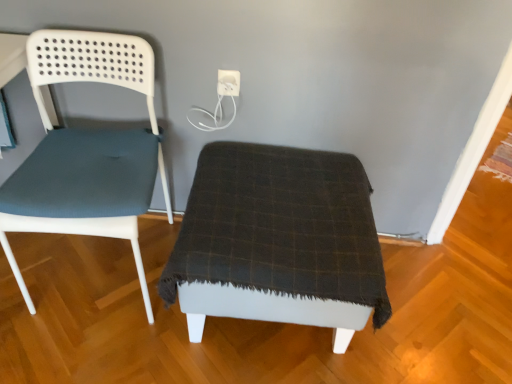
Question: From a real-world perspective, is dark plaid fabric ottoman at center under matte blue fabric chair at left?

Choices:
 (A) yes
 (B) no

Answer: (A)

Question: Is dark plaid fabric ottoman at center next to matte blue fabric chair at left and touching it?

Choices:
 (A) yes
 (B) no

Answer: (B)

Question: Is dark plaid fabric ottoman at center at the right side of matte blue fabric chair at left?

Choices:
 (A) yes
 (B) no

Answer: (A)

Question: From the image's perspective, is dark plaid fabric ottoman at center located above matte blue fabric chair at left?

Choices:
 (A) no
 (B) yes

Answer: (A)

Question: Is matte blue fabric chair at left at the back of dark plaid fabric ottoman at center?

Choices:
 (A) yes
 (B) no

Answer: (B)

Question: Do you think white plastic electric outlet at upper center is within dark plaid fabric ottoman at center, or outside of it?

Choices:
 (A) outside
 (B) inside

Answer: (A)

Question: In the image, is white plastic electric outlet at upper center positioned in front of or behind dark plaid fabric ottoman at center?

Choices:
 (A) front
 (B) behind

Answer: (B)

Question: Is point (222, 82) positioned closer to the camera than point (286, 314)?

Choices:
 (A) farther
 (B) closer

Answer: (A)

Question: In the image, is white plastic electric outlet at upper center on the left side or the right side of dark plaid fabric ottoman at center?

Choices:
 (A) right
 (B) left

Answer: (B)

Question: From a real-world perspective, is dark plaid fabric ottoman at center physically located above or below white plastic electric outlet at upper center?

Choices:
 (A) below
 (B) above

Answer: (A)

Question: Considering the relative positions of dark plaid fabric ottoman at center and white plastic electric outlet at upper center in the image provided, is dark plaid fabric ottoman at center to the left or to the right of white plastic electric outlet at upper center?

Choices:
 (A) left
 (B) right

Answer: (B)

Question: Is dark plaid fabric ottoman at center taller or shorter than white plastic electric outlet at upper center?

Choices:
 (A) tall
 (B) short

Answer: (A)

Question: Considering the positions of dark plaid fabric ottoman at center and white plastic electric outlet at upper center in the image, is dark plaid fabric ottoman at center bigger or smaller than white plastic electric outlet at upper center?

Choices:
 (A) big
 (B) small

Answer: (A)

Question: Considering the positions of point (69, 142) and point (182, 306), is point (69, 142) closer or farther from the camera than point (182, 306)?

Choices:
 (A) closer
 (B) farther

Answer: (B)

Question: Considering their positions, is matte blue fabric chair at left located in front of or behind dark plaid fabric ottoman at center?

Choices:
 (A) behind
 (B) front

Answer: (B)